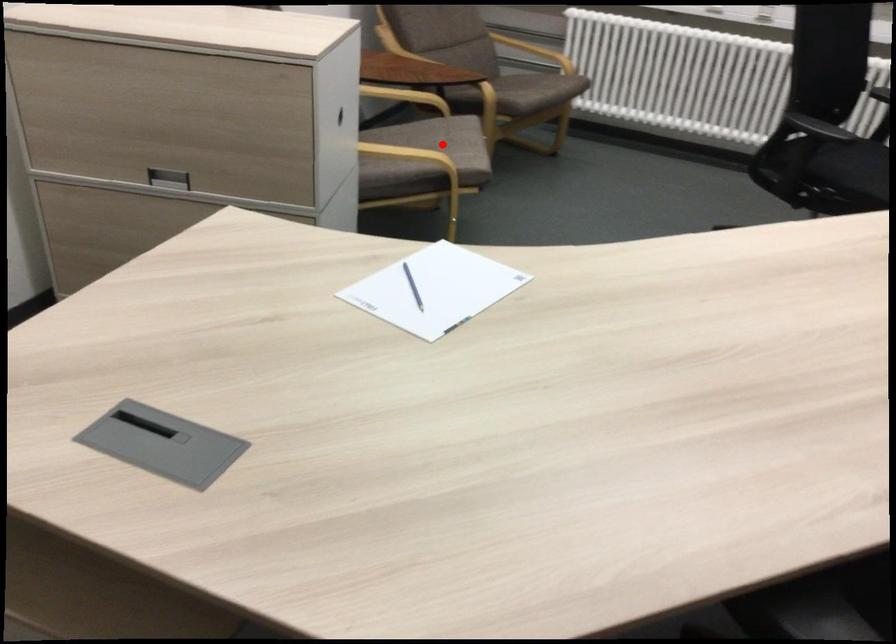
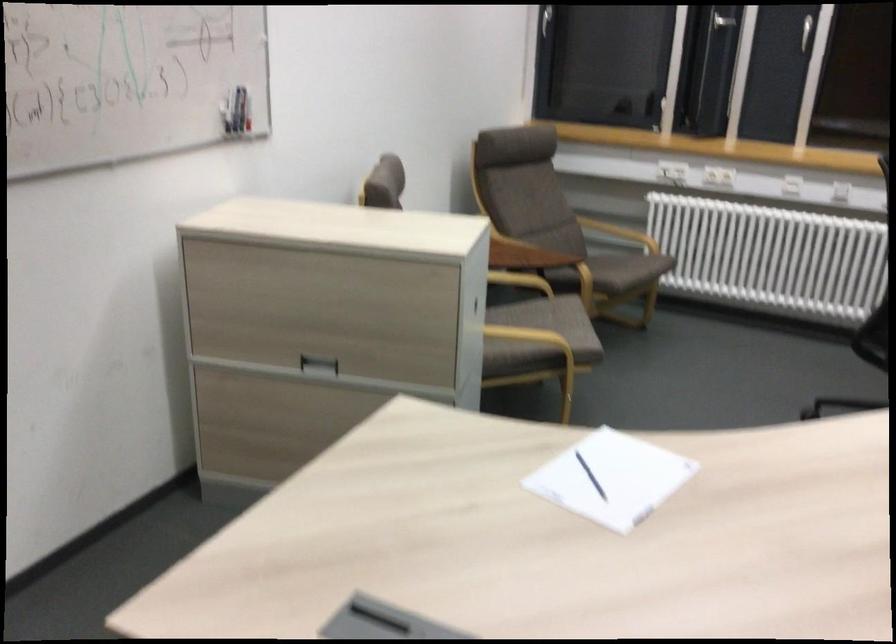
In the second image, find the point that corresponds to the highlighted location in the first image.

(552, 321)